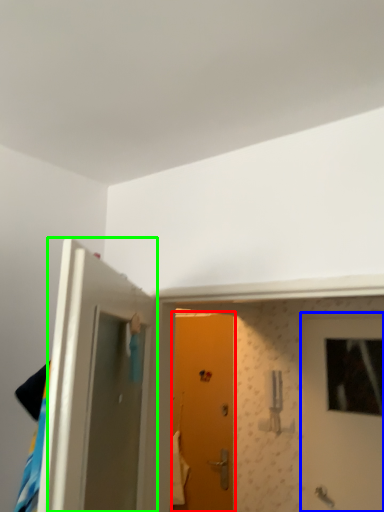
Question: Considering the real-world distances, which object is farthest from door (highlighted by a red box)? door (highlighted by a blue box) or door (highlighted by a green box)?

Choices:
 (A) door
 (B) door

Answer: (B)